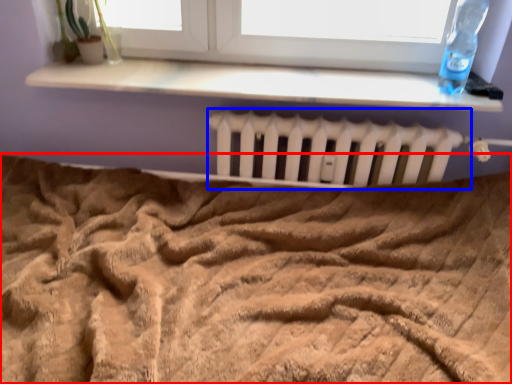
Question: Which of the following is the farthest to the observer, bed (highlighted by a red box) or radiator (highlighted by a blue box)?

Choices:
 (A) bed
 (B) radiator

Answer: (B)